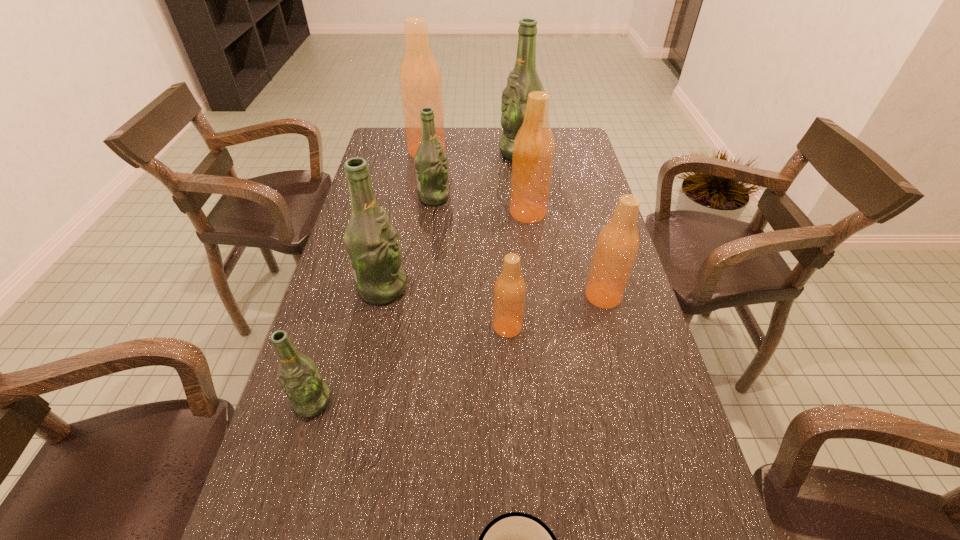
Identify the location of the farthest green beer bottle. This screenshot has width=960, height=540. (523, 79).

Where is `the biggest green beer bottle`? This screenshot has width=960, height=540. the biggest green beer bottle is located at coordinates (523, 79).

Find the location of a particular element. Image resolution: width=960 pixels, height=540 pixels. the farthest tan beer bottle is located at coordinates (420, 80).

The height and width of the screenshot is (540, 960). What are the coordinates of `the biggest tan beer bottle` in the screenshot? It's located at (420, 80).

This screenshot has height=540, width=960. In order to click on the third farthest green beer bottle in this screenshot , I will do point(371,242).

The width and height of the screenshot is (960, 540). Identify the location of the third nearest tan beer bottle. (534, 146).

Identify the location of the third nearest green beer bottle. This screenshot has height=540, width=960. (430, 161).

The image size is (960, 540). What are the coordinates of `the second nearest tan beer bottle` in the screenshot? It's located at (617, 245).

You are a GUI agent. You are given a task and a screenshot of the screen. Output one action in this format:
    pyautogui.click(x=<x>, y=<y>)
    Task: Click on the rightmost object
    Image resolution: width=960 pixels, height=540 pixels.
    Given the screenshot: What is the action you would take?
    pyautogui.click(x=617, y=245)

I want to click on the smallest tan beer bottle, so click(510, 288).